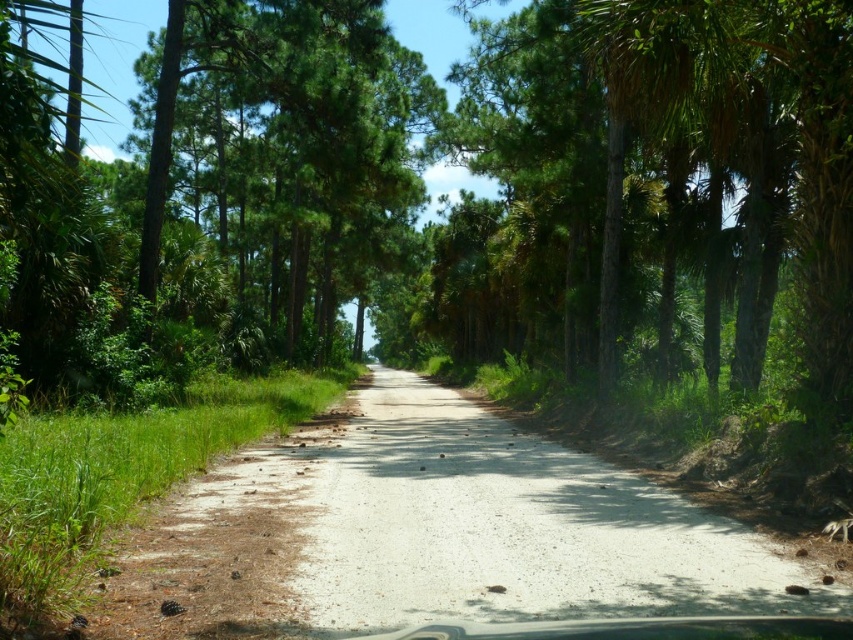
In the scene shown: You are standing at the starting point of the dirt road and want to reach the green leafy tree at center. According to the coordinates provided, in which direction should you head from your current position?

The green leafy tree at center is located at coordinates point (459,163), so you should head towards the center of the image to reach it.

You are standing at the edge of the dirt road at center and want to walk to the green leafy tree at center. In which direction should you head?

The green leafy tree at center is positioned on the left side of dirt road at center, so you should head to the left to reach it.